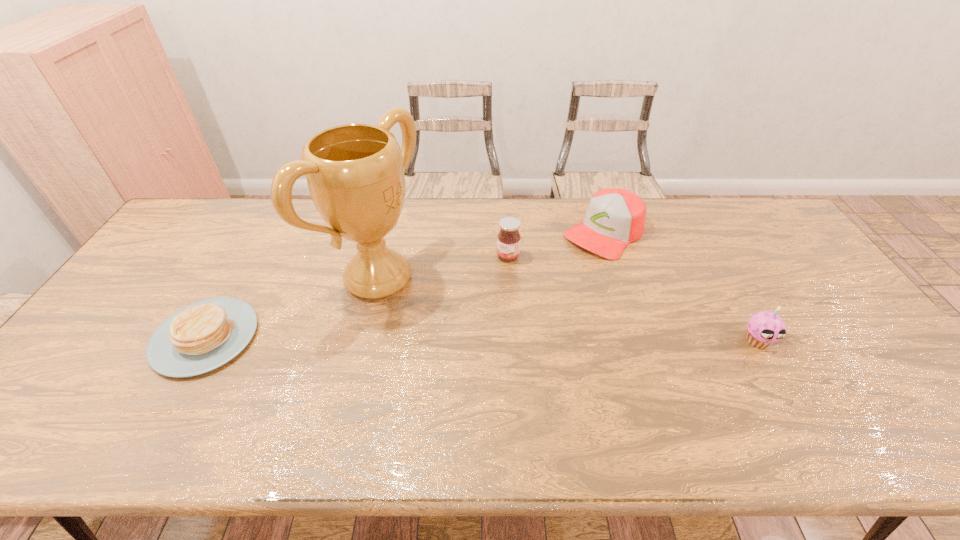
Image resolution: width=960 pixels, height=540 pixels. Find the location of `object that is at the near edge`. object that is at the near edge is located at coordinates (205, 335).

Identify the location of free spot at the far edge of the desktop. (403, 216).

What are the coordinates of `free space at the near edge of the desktop` in the screenshot? It's located at (136, 384).

Find the location of a particular element. The height and width of the screenshot is (540, 960). vacant position at the left edge of the desktop is located at coordinates (169, 275).

The height and width of the screenshot is (540, 960). I want to click on free spot at the right edge of the desktop, so click(823, 322).

Where is `vacant space at the far right corner`? The width and height of the screenshot is (960, 540). vacant space at the far right corner is located at coordinates (738, 201).

At what (x,y) coordinates should I click in order to perform the action: click on free spot between the third object from left to right and the tallest object. Please return your answer as a coordinate pair (x, y). Image resolution: width=960 pixels, height=540 pixels. Looking at the image, I should click on (443, 267).

The height and width of the screenshot is (540, 960). What are the coordinates of `free spot between the award and the shortest object` in the screenshot? It's located at point(292,308).

Identify the location of vacant space that's between the jam and the cupcake. [633, 298].

Image resolution: width=960 pixels, height=540 pixels. I want to click on empty location between the second object from left to right and the pancake, so click(292, 308).